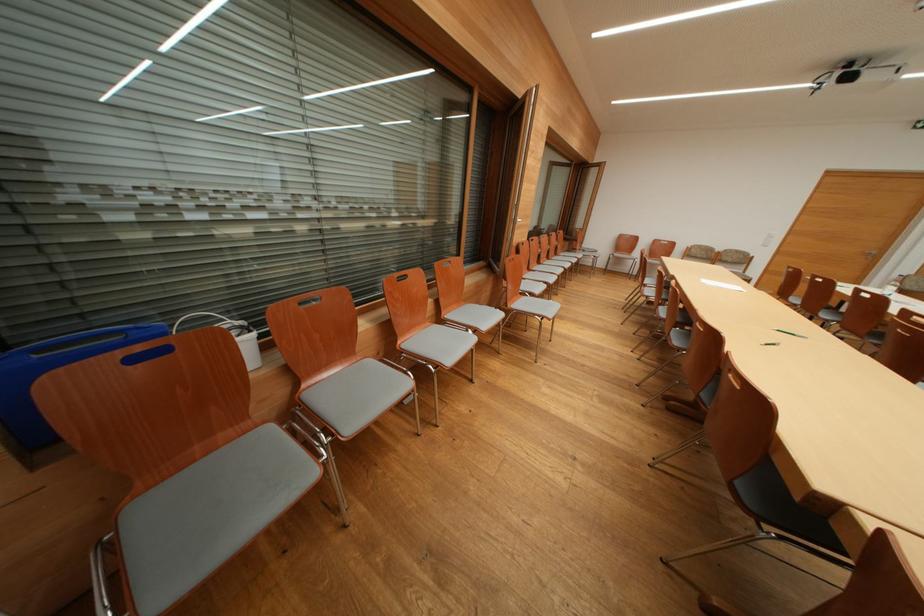
Find the location of a particular element. This screenshot has height=616, width=924. blue container handle is located at coordinates (78, 339).